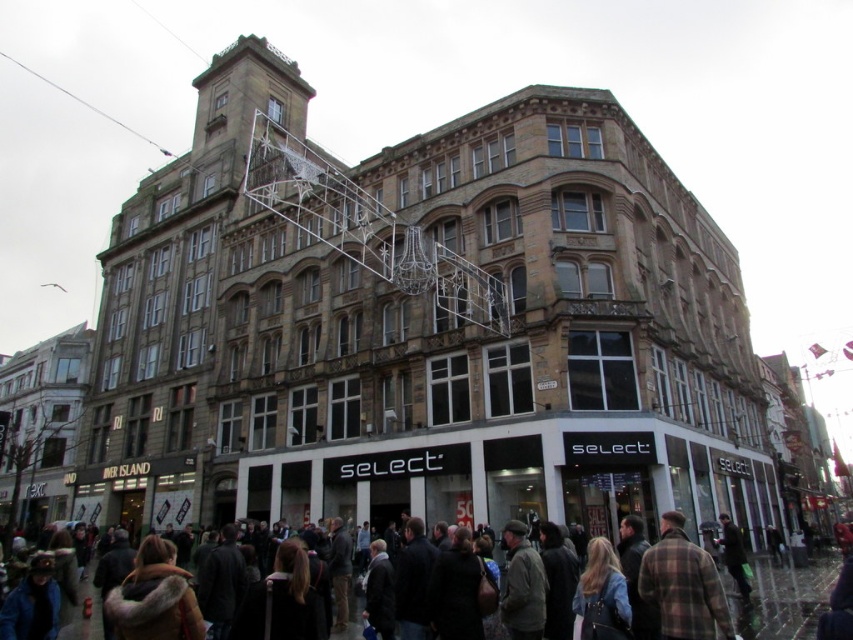
You are a customer standing in front of the building and want to see the dark brown leather jackets at lower center. Is the metallic silver scaffolding at upper center blocking your view of them?

The dark brown leather jackets at lower center is behind the metallic silver scaffolding at upper center, so the scaffolding is blocking your view of them.

You are a window cleaner with a ladder that can reach up to 3 meters. You need to clean the windows of the building near the metallic silver scaffolding at upper center and the dark brown leather jackets at lower center. Will your ladder be sufficient for both tasks?

The metallic silver scaffolding at upper center has a greater height compared to dark brown leather jackets at lower center. Since the ladder can reach up to 3 meters, it may be sufficient for the dark brown leather jackets at lower center, but likely insufficient for the metallic silver scaffolding at upper center if it exceeds 3 meters in height.

You are standing in front of the building and want to determine which of the two points, point (314, 193) or point (165, 577), is closer to you. Based on the scene, which point is nearer?

Point (314, 193) is closer to you because it is further to the viewer than point (165, 577).